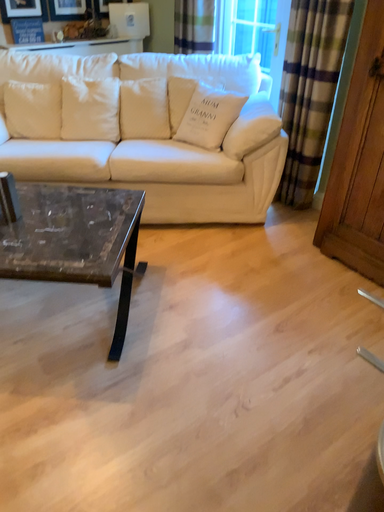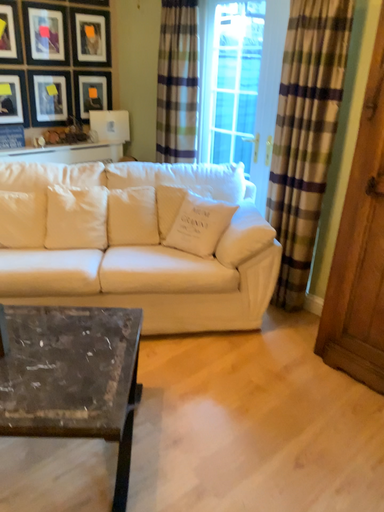
Question: Which way did the camera rotate in the video?

Choices:
 (A) rotated downward
 (B) rotated upward

Answer: (B)